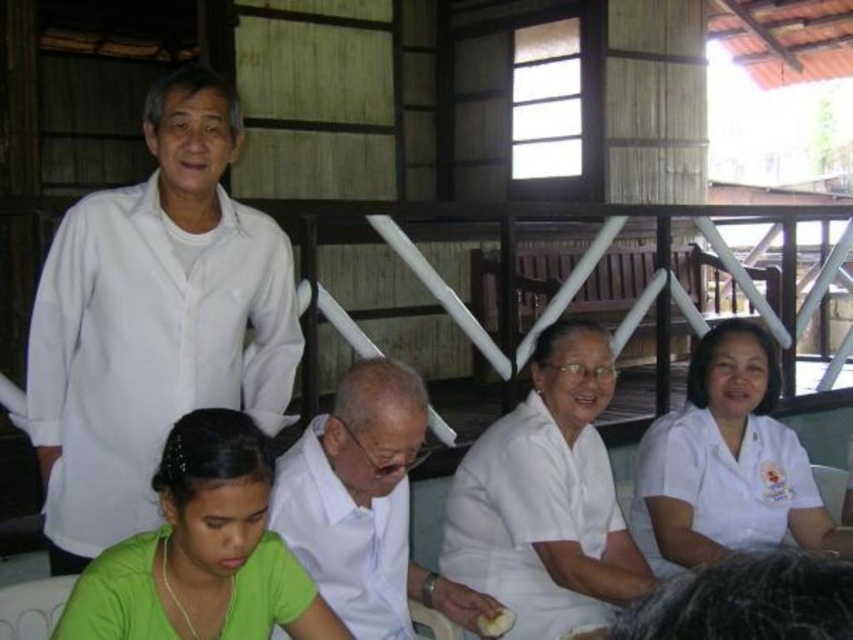
Between white glossy shirt at center and white smooth uniform at lower right, which one is positioned lower?

white smooth uniform at lower right is lower down.

Which is behind, point (345, 595) or point (679, 483)?

Point (679, 483)

I want to click on white glossy shirt at center, so click(x=364, y=506).

Is point (119, 467) in front of point (206, 449)?

That is False.

Can you confirm if white matte shirt at upper left is thinner than green matte shirt at lower left?

In fact, white matte shirt at upper left might be wider than green matte shirt at lower left.

Locate an element on the screen. This screenshot has height=640, width=853. white matte shirt at upper left is located at coordinates (154, 321).

Does green matte shirt at lower left appear under white matte bread at lower center?

No.

Is green matte shirt at lower left thinner than white matte bread at lower center?

No, green matte shirt at lower left is not thinner than white matte bread at lower center.

Who is more distant from viewer, (250,477) or (508,611)?

Point (508,611)

I want to click on green matte shirt at lower left, so click(x=202, y=552).